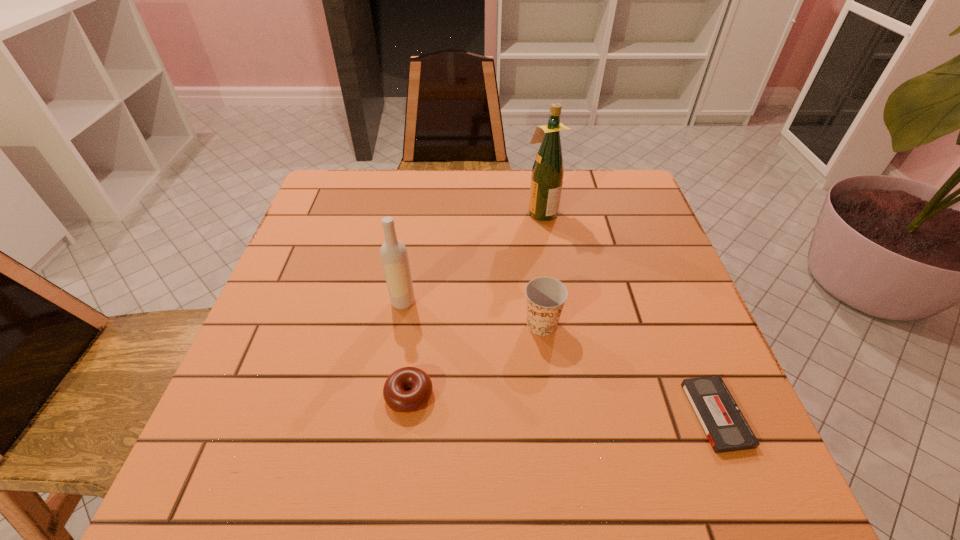
I want to click on vacant space situated on the front of the vodka, so click(394, 357).

You are a GUI agent. You are given a task and a screenshot of the screen. Output one action in this format:
    pyautogui.click(x=<x>, y=<y>)
    Task: Click on the blank space located 0.170m on the left of the third shortest object
    The height and width of the screenshot is (540, 960).
    Given the screenshot: What is the action you would take?
    pyautogui.click(x=441, y=324)

Find the location of a particular element. The image size is (960, 540). vacant space located 0.170m on the left of the second shortest object is located at coordinates (291, 395).

At what (x,y) coordinates should I click in order to perform the action: click on vacant area situated on the left of the rightmost object. Please return your answer as a coordinate pair (x, y). The height and width of the screenshot is (540, 960). Looking at the image, I should click on (606, 414).

The height and width of the screenshot is (540, 960). In order to click on object present at the far edge in this screenshot , I will do `click(547, 176)`.

You are a GUI agent. You are given a task and a screenshot of the screen. Output one action in this format:
    pyautogui.click(x=<x>, y=<y>)
    Task: Click on the object situated at the near edge
    
    Given the screenshot: What is the action you would take?
    pyautogui.click(x=723, y=423)

Where is `object at the right edge`? The width and height of the screenshot is (960, 540). object at the right edge is located at coordinates (723, 423).

This screenshot has width=960, height=540. In order to click on object that is at the near right corner in this screenshot , I will do `click(723, 423)`.

Image resolution: width=960 pixels, height=540 pixels. In the image, there is a desktop. Identify the location of vacant area at the far edge. (418, 177).

This screenshot has width=960, height=540. In the image, there is a desktop. What are the coordinates of `vacant space at the near edge` in the screenshot? It's located at (519, 483).